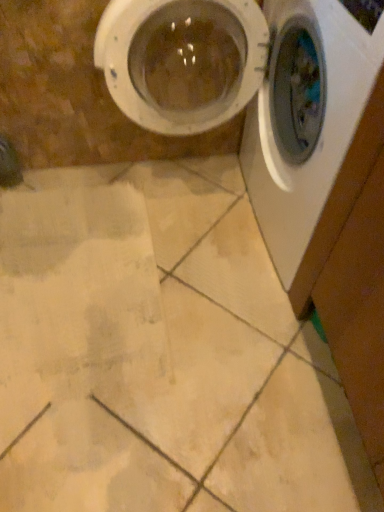
Question: From a real-world perspective, is white glossy washing machine at right, which is the first washing machine from right to left, positioned above or below white plastic washing machine at upper right, the 2th washing machine when ordered from right to left?

Choices:
 (A) above
 (B) below

Answer: (B)

Question: Considering their positions, is white glossy washing machine at right, which is the first washing machine from right to left, located in front of or behind white plastic washing machine at upper right, which ranks as the first washing machine in left-to-right order?

Choices:
 (A) front
 (B) behind

Answer: (A)

Question: Is point (357, 79) positioned closer to the camera than point (329, 111)?

Choices:
 (A) closer
 (B) farther

Answer: (A)

Question: Looking at their shapes, would you say white plastic washing machine at upper right, which ranks as the first washing machine in left-to-right order, is wider or thinner than white glossy washing machine at right, which is the first washing machine from right to left?

Choices:
 (A) wide
 (B) thin

Answer: (A)

Question: Relative to white glossy washing machine at right, which ranks as the 2th washing machine in left-to-right order, is white plastic washing machine at upper right, which ranks as the first washing machine in left-to-right order, in front or behind?

Choices:
 (A) behind
 (B) front

Answer: (A)

Question: From a real-world perspective, is white plastic washing machine at upper right, which ranks as the first washing machine in left-to-right order, positioned above or below white glossy washing machine at right, which is the first washing machine from right to left?

Choices:
 (A) below
 (B) above

Answer: (B)

Question: From the image's perspective, is white plastic washing machine at upper right, which ranks as the first washing machine in left-to-right order, above or below white glossy washing machine at right, which ranks as the 2th washing machine in left-to-right order?

Choices:
 (A) below
 (B) above

Answer: (B)